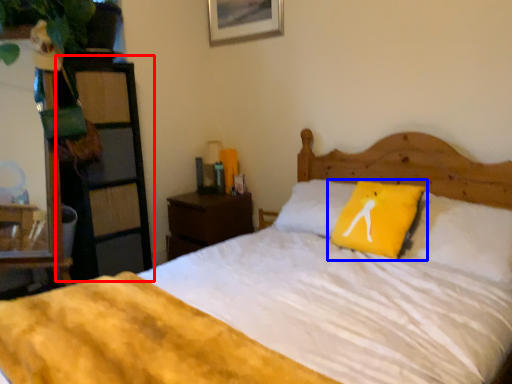
Question: Which object is further to the camera taking this photo, dresser (highlighted by a red box) or pillow (highlighted by a blue box)?

Choices:
 (A) dresser
 (B) pillow

Answer: (A)